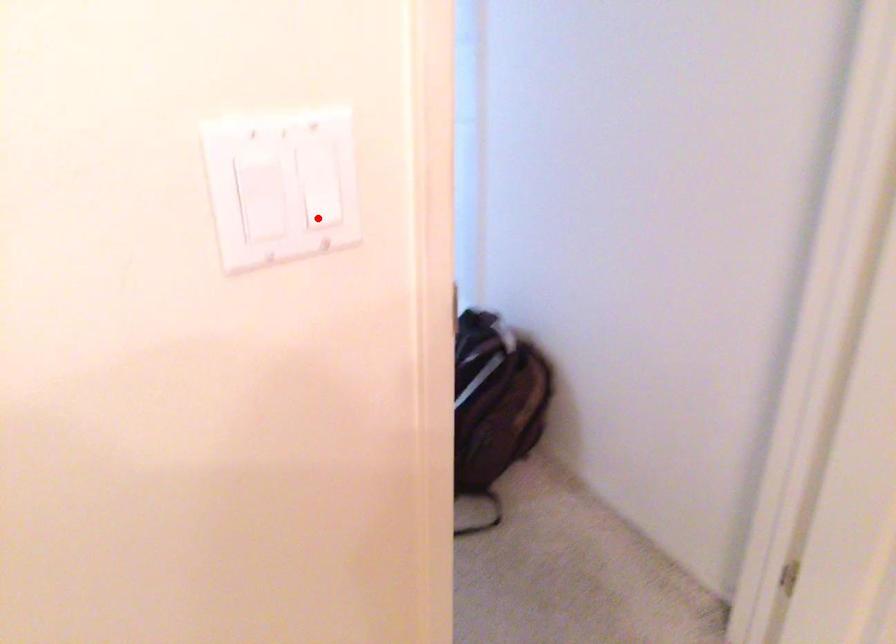
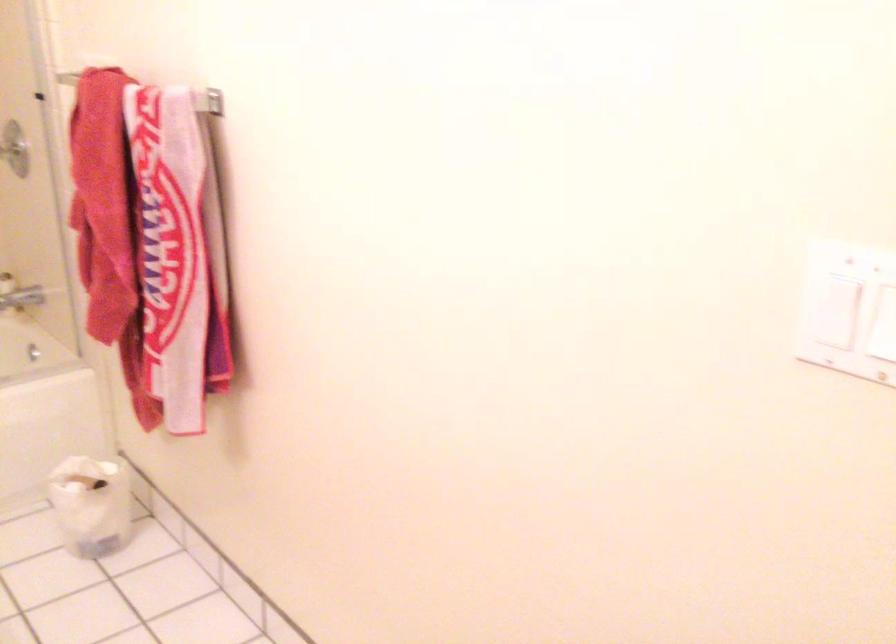
Question: A red point is marked in image1. In image2, is the corresponding 3D point closer to the camera or farther? Reply with the corresponding letter.

Choices:
 (A) The corresponding 3D point is closer.
 (B) The corresponding 3D point is farther.

Answer: (B)